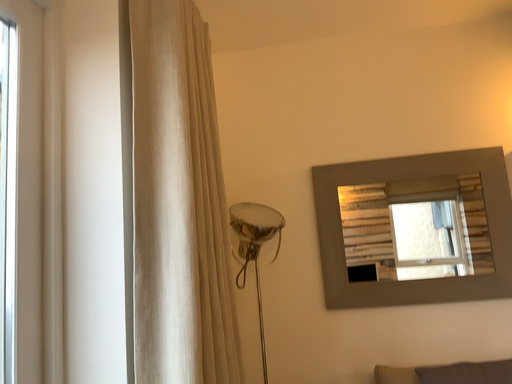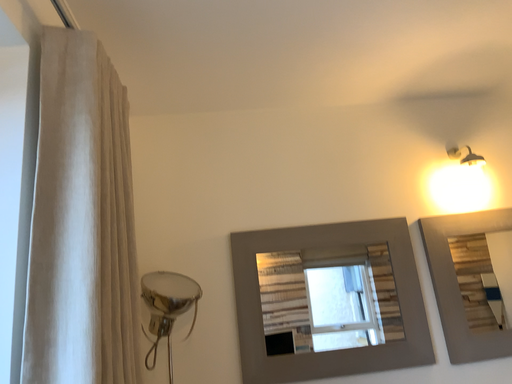
Question: Which way did the camera rotate in the video?

Choices:
 (A) rotated upward
 (B) rotated downward

Answer: (A)